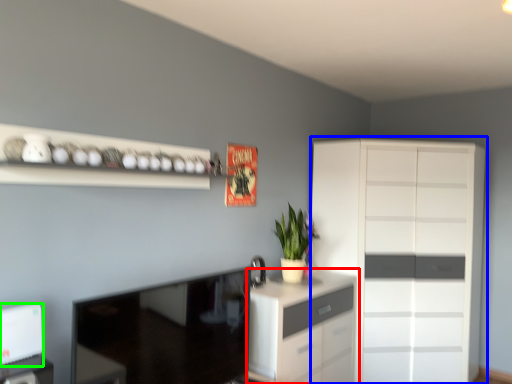
Question: Estimate the real-world distances between objects in this image. Which object is farther from chest of drawers (highlighted by a red box), cupboard (highlighted by a blue box) or appliance (highlighted by a green box)?

Choices:
 (A) cupboard
 (B) appliance

Answer: (B)